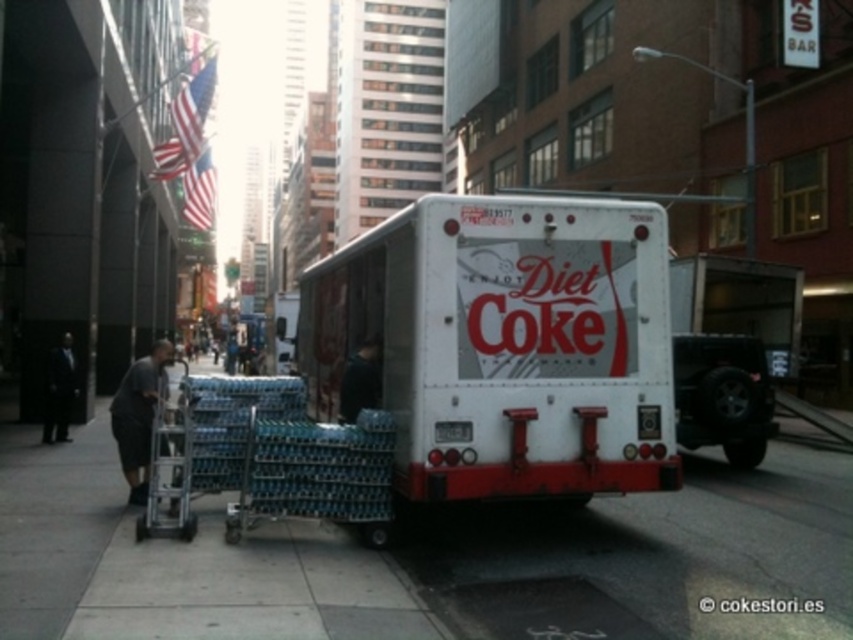
Question: Can you confirm if white concrete sidewalk at lower center is positioned to the left of white matte truck at center?

Choices:
 (A) no
 (B) yes

Answer: (B)

Question: Can you confirm if white concrete sidewalk at lower center is bigger than white matte truck at center?

Choices:
 (A) yes
 (B) no

Answer: (A)

Question: Which object is closer to the camera taking this photo?

Choices:
 (A) white matte truck at center
 (B) white concrete sidewalk at lower center

Answer: (B)

Question: Observing the image, what is the correct spatial positioning of white concrete sidewalk at lower center in reference to white matte truck at center?

Choices:
 (A) right
 (B) left

Answer: (B)

Question: Which object is farther from the camera taking this photo?

Choices:
 (A) white concrete sidewalk at lower center
 (B) white matte truck at center

Answer: (B)